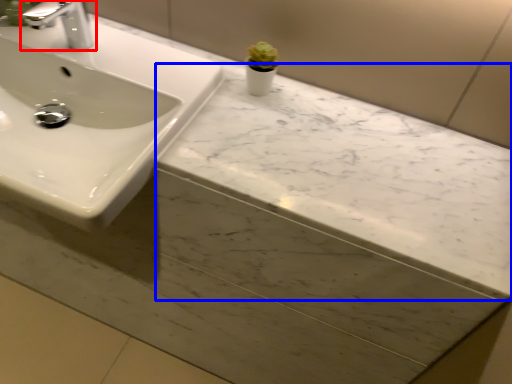
Question: Which object is further to the camera taking this photo, tap (highlighted by a red box) or counter top (highlighted by a blue box)?

Choices:
 (A) tap
 (B) counter top

Answer: (A)